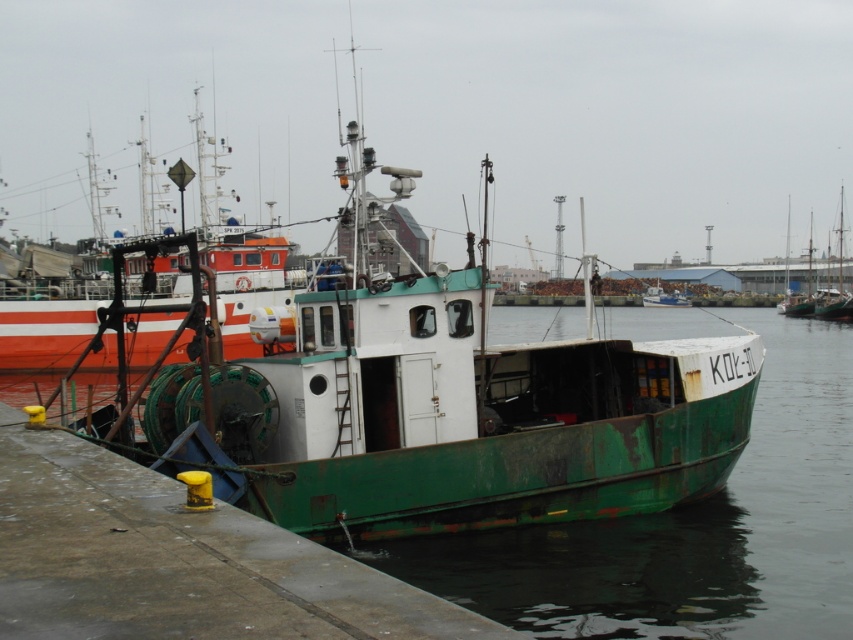
Question: Does green rusty water at lower center have a greater width compared to green rusty boat at center?

Choices:
 (A) yes
 (B) no

Answer: (A)

Question: Among these objects, which one is farthest from the camera?

Choices:
 (A) green rusty boat at center
 (B) concrete dock at lower left

Answer: (A)

Question: Which object is farther from the camera taking this photo?

Choices:
 (A) green rusty boat at center
 (B) concrete dock at lower left
 (C) green rusty water at lower center

Answer: (A)

Question: Which object is closer to the camera taking this photo?

Choices:
 (A) green rusty boat at center
 (B) concrete dock at lower left
 (C) green rusty water at lower center

Answer: (B)

Question: Is green rusty water at lower center closer to camera compared to green rusty boat at center?

Choices:
 (A) no
 (B) yes

Answer: (B)

Question: Does green rusty water at lower center have a greater width compared to green rusty boat at center?

Choices:
 (A) no
 (B) yes

Answer: (B)